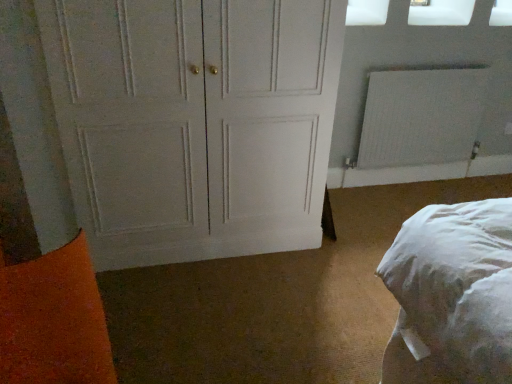
Locate an element on the screen. This screenshot has width=512, height=384. free area in between white painted wood door at center and white textured radiator at upper right is located at coordinates (378, 205).